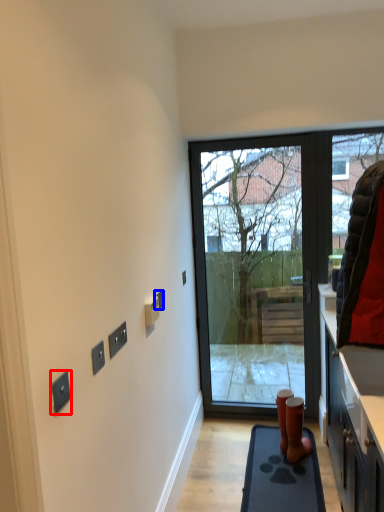
Question: Which object appears closest to the camera in this image, electric outlet (highlighted by a red box) or electric outlet (highlighted by a blue box)?

Choices:
 (A) electric outlet
 (B) electric outlet

Answer: (A)